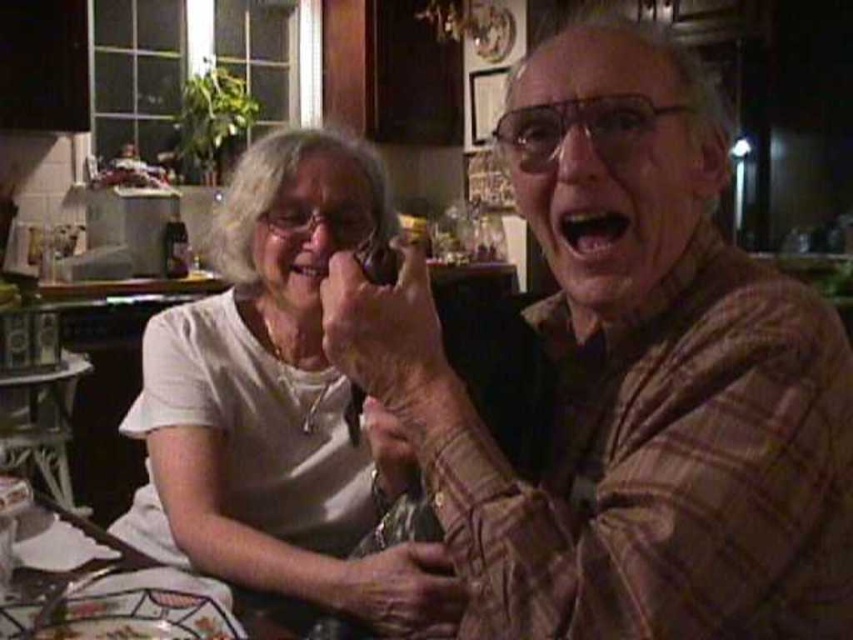
You are a delivery person who needs to place a small package on the nearest available surface. You see the white glossy plate at lower left. Is it within reach for you to place the package on it?

The white glossy plate at lower left is 29.19 inches away from viewer, so yes, it is within reach to place the package on it since 29.19 inches is a reachable distance for a person.

You are standing in the kitchen and notice the brown plaid shirt at center. Can you determine its exact position using the coordinate system provided?

The brown plaid shirt at center is located at point (627, 380) in the coordinate system.

You are standing in the kitchen and want to reach the point at coordinates point (173, 416). If your arm can extend 3 feet, can you reach it?

The point (173, 416) is 3.67 feet away from the viewer. Since your arm can only extend 3 feet, you cannot reach it.